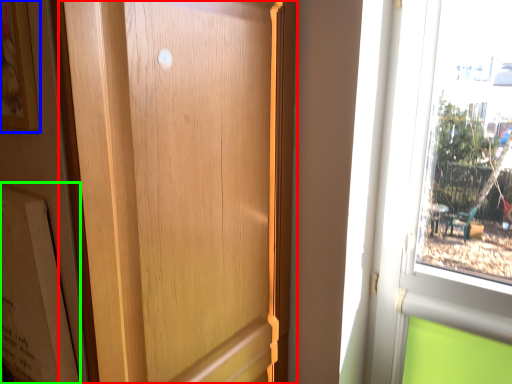
Question: Estimate the real-world distances between objects in this image. Which object is closer to door (highlighted by a red box), picture frame (highlighted by a blue box) or bulletin board (highlighted by a green box)?

Choices:
 (A) picture frame
 (B) bulletin board

Answer: (B)